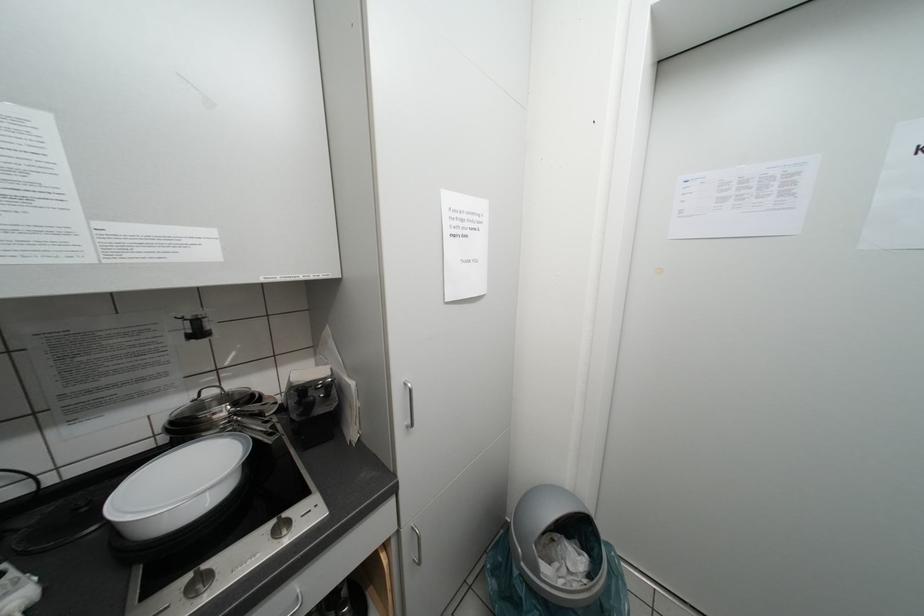
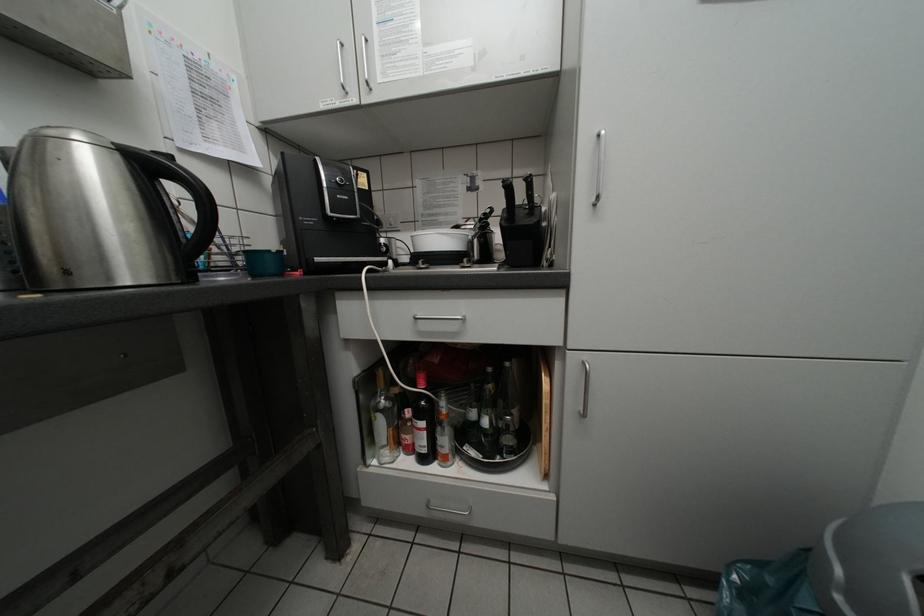
Question: The camera is either moving clockwise (left) or counter-clockwise (right) around the object. The first image is from the beginning of the video and the second image is from the end. Is the camera moving left or right when shooting the video?

Choices:
 (A) Left
 (B) Right

Answer: (B)